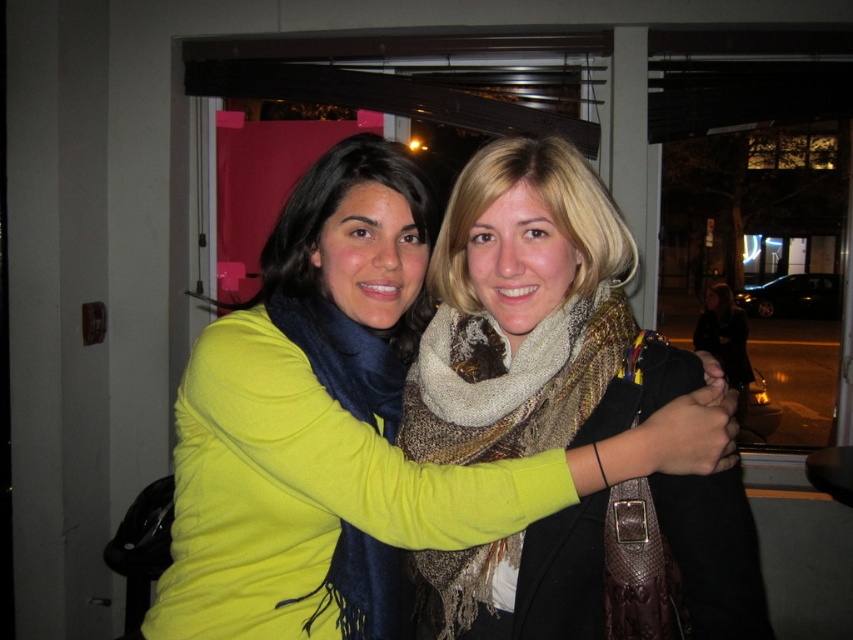
Is point (367, 243) less distant than point (405, 412)?

Yes, it is.

This screenshot has height=640, width=853. Describe the element at coordinates (351, 429) in the screenshot. I see `matte yellow sweater at center` at that location.

Locate an element on the screen. Image resolution: width=853 pixels, height=640 pixels. matte yellow sweater at center is located at coordinates (351, 429).